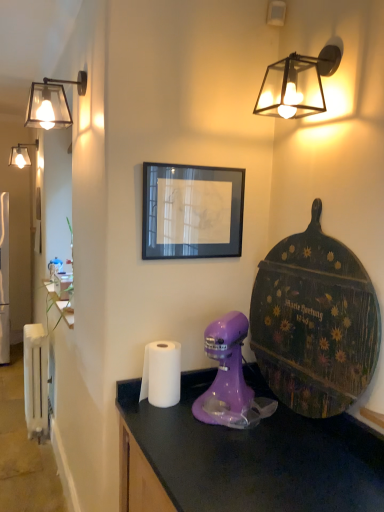
Question: Does point (276, 61) appear closer or farther from the camera than point (150, 207)?

Choices:
 (A) closer
 (B) farther

Answer: (B)

Question: In terms of height, does matte black glass lamp at upper right, positioned as the third lamp in left-to-right order, look taller or shorter compared to black glass picture frame at center?

Choices:
 (A) short
 (B) tall

Answer: (A)

Question: Which object is the farthest from the white metallic radiator at left?

Choices:
 (A) white paper towel at center
 (B) matte glass lampshade at upper left, the second lamp from the back
 (C) matte black glass lamp at upper right, which is the 1th lamp in front-to-back order
 (D) matte glass lamp at upper left, the 3th lamp viewed from the right
 (E) black glass picture frame at center

Answer: (C)

Question: Which of these objects is positioned closest to the matte glass lamp at upper left, the 3th lamp viewed from the right?

Choices:
 (A) matte black glass lamp at upper right, marked as the 1th lamp in a right-to-left arrangement
 (B) matte purple mixer at center
 (C) matte glass lampshade at upper left, arranged as the second lamp when viewed from the right
 (D) black glass picture frame at center
 (E) white paper towel at center

Answer: (C)